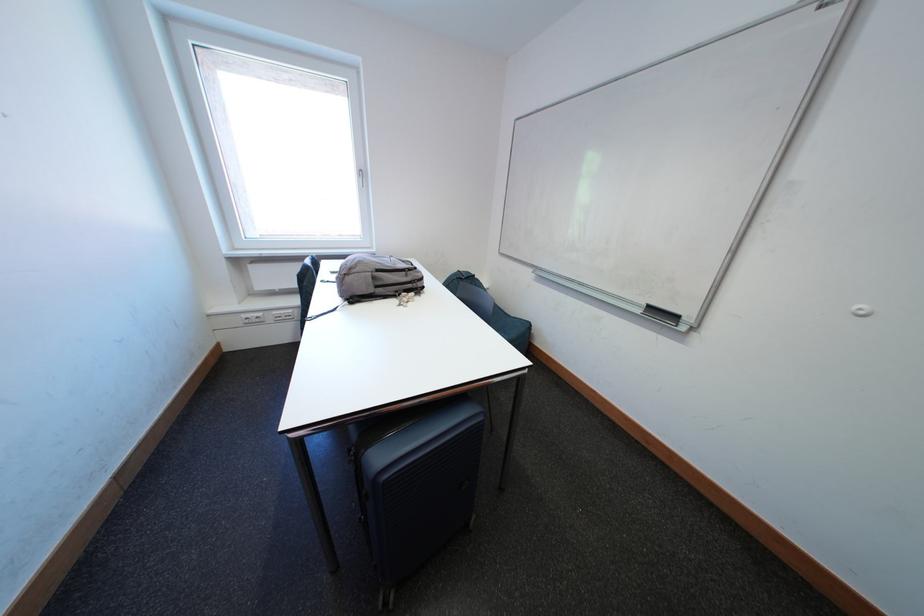
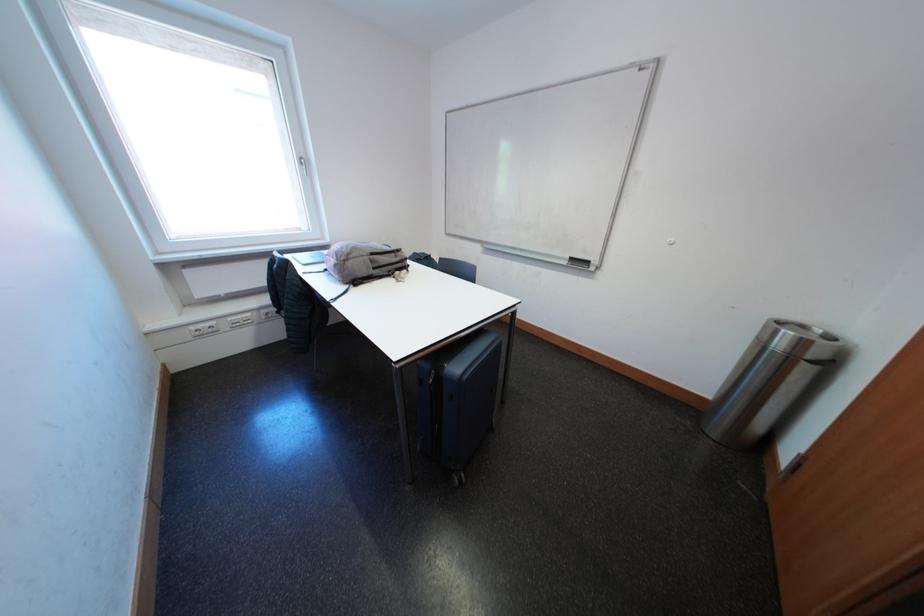
The point at [416,280] is marked in the first image. Where is the corresponding point in the second image?

(406, 261)